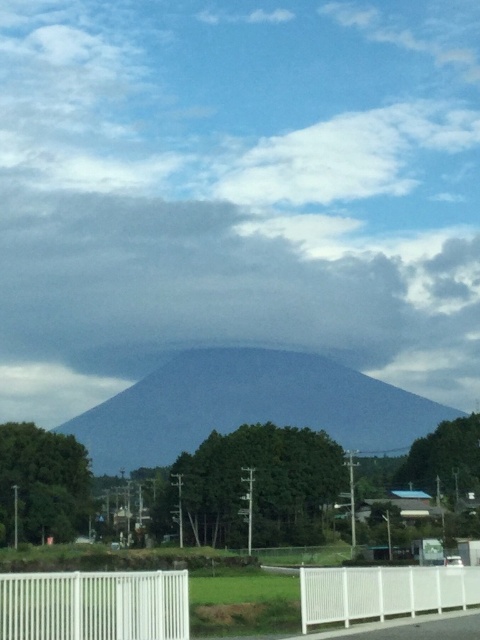
You are a painter setting up your easel to paint the landscape. You want to ensure that the blue matte mountain at center and the white plastic fence at lower left are both visible in your painting. Given their sizes, which object will appear larger in your painting?

The blue matte mountain at center will appear larger in your painting because it is taller than the white plastic fence at lower left.